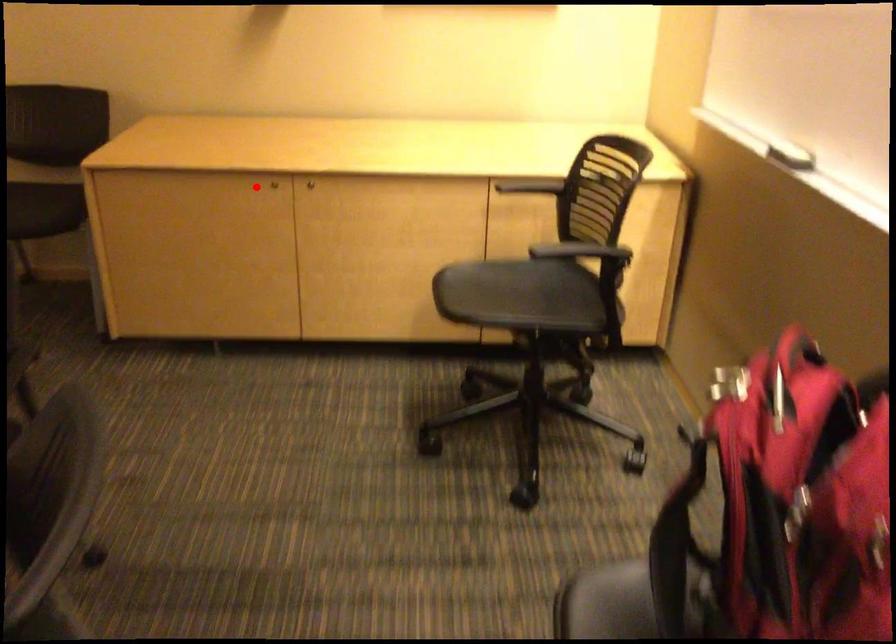
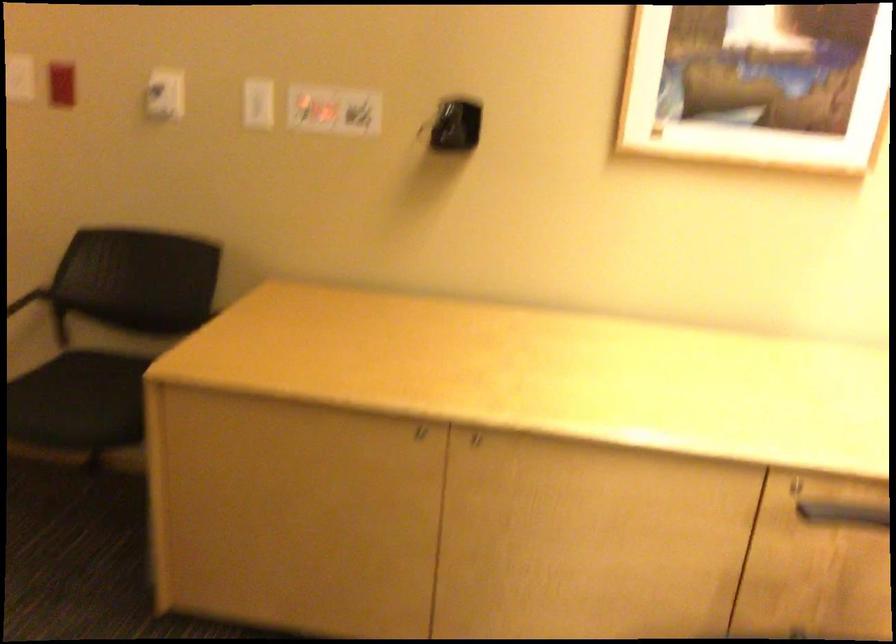
Question: I am providing you with two images of the same scene from different viewpoints. In image1, a red point is highlighted. Considering the same 3D point in image2, which of the following is correct?

Choices:
 (A) It is closer
 (B) It is farther

Answer: (A)